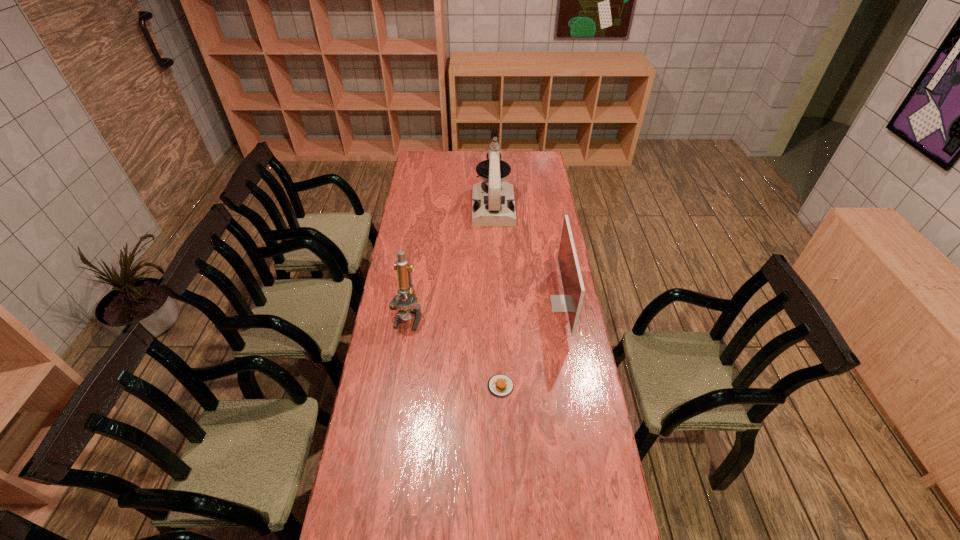
Locate an element on the screen. This screenshot has height=540, width=960. the right microscope is located at coordinates (493, 204).

Identify the location of the tallest object. The width and height of the screenshot is (960, 540). (493, 204).

The image size is (960, 540). What are the coordinates of `the leftmost object` in the screenshot? It's located at (406, 308).

You are a GUI agent. You are given a task and a screenshot of the screen. Output one action in this format:
    pyautogui.click(x=<x>, y=<y>)
    Task: Click on the nearer microscope
    Image resolution: width=960 pixels, height=540 pixels.
    Given the screenshot: What is the action you would take?
    pyautogui.click(x=406, y=308)

Locate an element on the screen. the rightmost object is located at coordinates (572, 283).

The image size is (960, 540). I want to click on the shortest object, so point(500,385).

Where is `food`? The height and width of the screenshot is (540, 960). food is located at coordinates (500, 385).

Where is `vacant point located at the eyepiece of the taller microscope`? vacant point located at the eyepiece of the taller microscope is located at coordinates (495, 252).

Image resolution: width=960 pixels, height=540 pixels. In order to click on free space located 0.370m on the right of the nearer microscope in this screenshot , I will do `click(515, 316)`.

Locate an element on the screen. This screenshot has width=960, height=540. free space located on the front-facing side of the monitor is located at coordinates (540, 303).